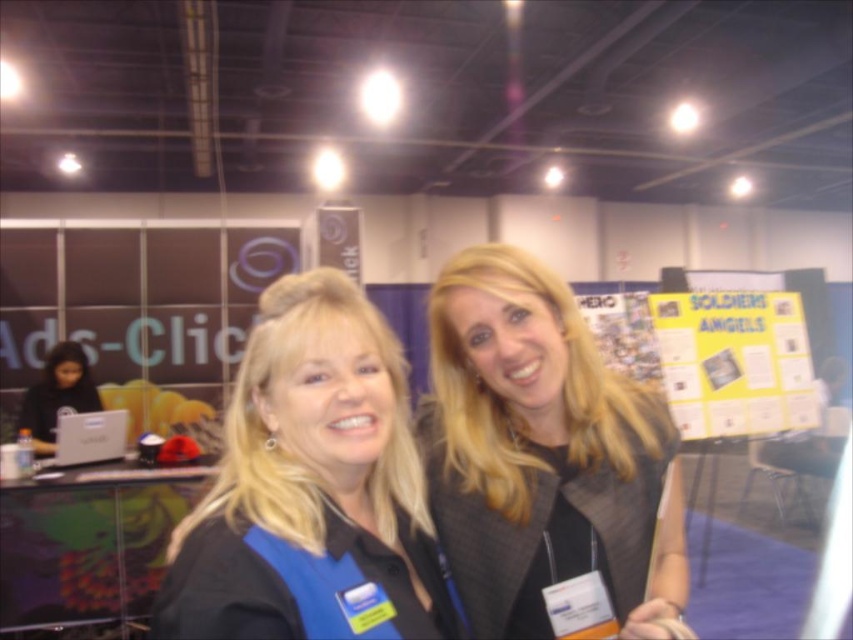
Question: Which of these objects is positioned closest to the blue fabric shirt at center?

Choices:
 (A) gray textured blazer at center
 (B) black matte laptop at left

Answer: (A)

Question: Is gray textured blazer at center smaller than blue fabric shirt at center?

Choices:
 (A) no
 (B) yes

Answer: (A)

Question: Is gray textured blazer at center below blue fabric shirt at center?

Choices:
 (A) yes
 (B) no

Answer: (B)

Question: Does gray textured blazer at center appear on the left side of blue fabric shirt at center?

Choices:
 (A) yes
 (B) no

Answer: (B)

Question: Which object appears farthest from the camera in this image?

Choices:
 (A) blue fabric shirt at center
 (B) gray textured blazer at center
 (C) black matte laptop at left

Answer: (C)

Question: Estimate the real-world distances between objects in this image. Which object is farther from the black matte laptop at left?

Choices:
 (A) gray textured blazer at center
 (B) blue fabric shirt at center

Answer: (B)